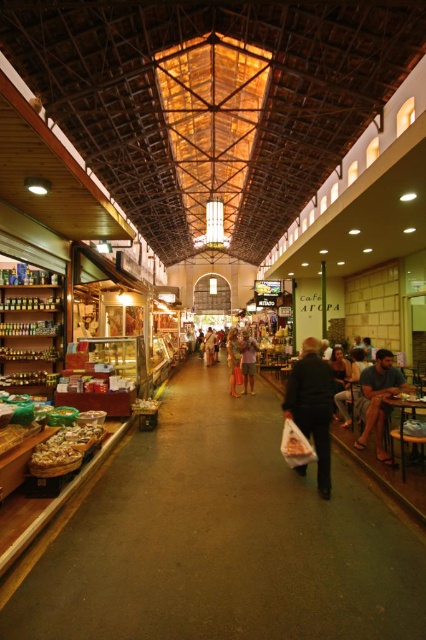
Can you confirm if dark gray fabric bag at center is bigger than dark blue fabric shirt at right?

Incorrect, dark gray fabric bag at center is not larger than dark blue fabric shirt at right.

Is dark gray fabric bag at center taller than dark blue fabric shirt at right?

In fact, dark gray fabric bag at center may be shorter than dark blue fabric shirt at right.

Is point (293, 412) more distant than point (382, 416)?

No, (293, 412) is closer to viewer.

Where is `dark gray fabric bag at center`? The width and height of the screenshot is (426, 640). dark gray fabric bag at center is located at coordinates (313, 406).

Does point (238, 339) come in front of point (210, 342)?

Yes, point (238, 339) is in front of point (210, 342).

Does orange fabric dress at center have a greater width compared to light brown leather shoes at center?

In fact, orange fabric dress at center might be narrower than light brown leather shoes at center.

Locate an element on the screen. The image size is (426, 640). orange fabric dress at center is located at coordinates (233, 360).

Can you confirm if matte brown wooden aisle at center is positioned below light brown leather shoes at center?

Correct, matte brown wooden aisle at center is located below light brown leather shoes at center.

Does matte brown wooden aisle at center appear on the left side of light brown leather shoes at center?

In fact, matte brown wooden aisle at center is to the right of light brown leather shoes at center.

Where is `matte brown wooden aisle at center`? Image resolution: width=426 pixels, height=640 pixels. matte brown wooden aisle at center is located at coordinates (222, 540).